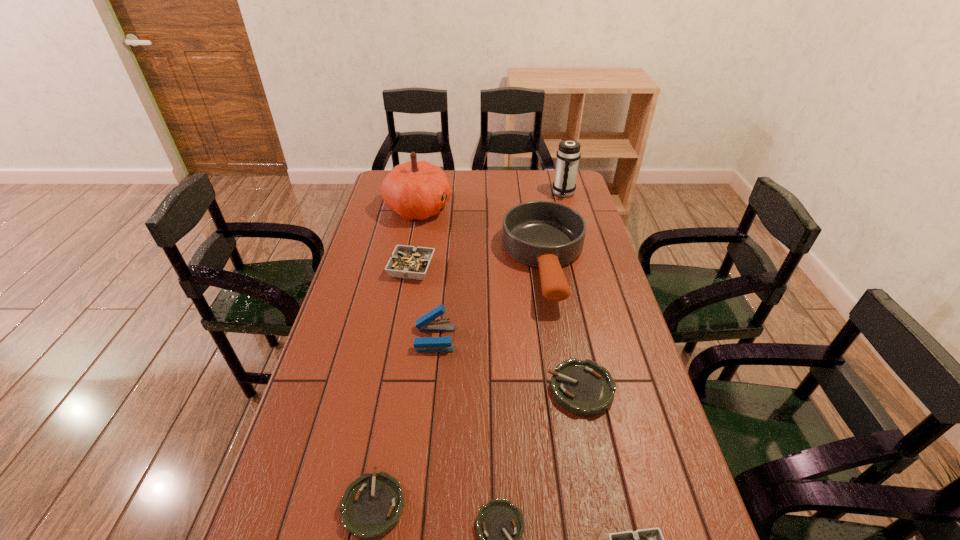
The width and height of the screenshot is (960, 540). In order to click on pink pumpkin in this screenshot , I will do `click(414, 190)`.

This screenshot has height=540, width=960. I want to click on thermos bottle, so click(x=568, y=154).

Where is `gray pan`? The height and width of the screenshot is (540, 960). gray pan is located at coordinates (547, 235).

The width and height of the screenshot is (960, 540). Identify the location of the third tallest object. (547, 235).

At what (x,y) coordinates should I click in order to perform the action: click on stapler. Please return your answer as a coordinate pair (x, y). Image resolution: width=960 pixels, height=540 pixels. Looking at the image, I should click on (428, 322).

Where is `the sixth shortest object`? the sixth shortest object is located at coordinates (428, 322).

Locate an element on the screen. The width and height of the screenshot is (960, 540). the fifth tallest object is located at coordinates (409, 262).

The width and height of the screenshot is (960, 540). I want to click on the farther gray ashtray, so click(409, 262).

Locate an element on the screen. Image resolution: width=960 pixels, height=540 pixels. the fourth nearest object is located at coordinates [x=583, y=387].

You are a GUI agent. You are given a task and a screenshot of the screen. Output one action in this format:
    pyautogui.click(x=<x>, y=<y>)
    Task: Click on the farthest green ashtray
    The width and height of the screenshot is (960, 540).
    Given the screenshot: What is the action you would take?
    pyautogui.click(x=583, y=387)